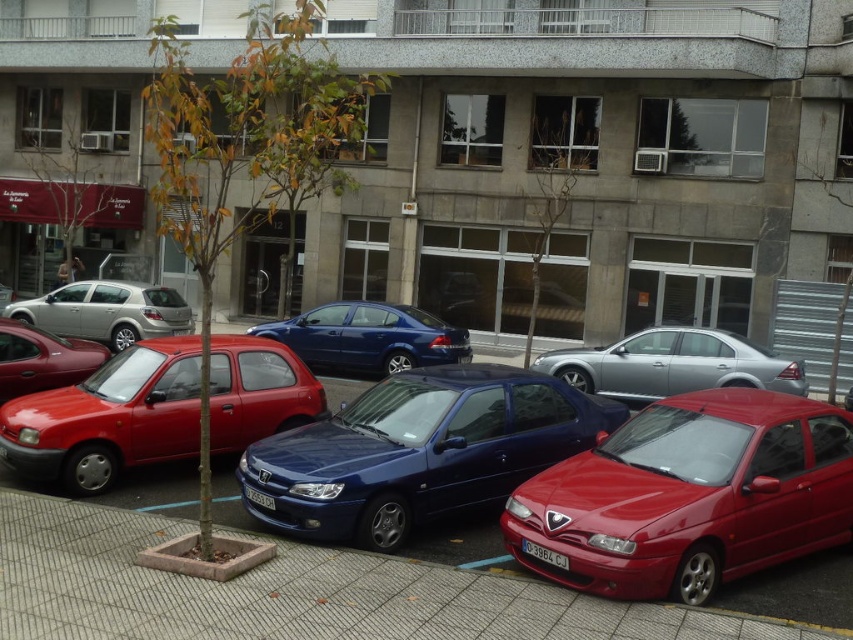
Between point (518, 424) and point (258, 360), which one is positioned behind?

Positioned behind is point (258, 360).

Looking at this image, can you confirm if glossy blue car at center is positioned above matte red car at center?

No, glossy blue car at center is not above matte red car at center.

Describe the element at coordinates (419, 451) in the screenshot. The width and height of the screenshot is (853, 640). I see `glossy blue car at center` at that location.

Find the location of `glossy blue car at center`. glossy blue car at center is located at coordinates (419, 451).

Does glossy blue sedan at center appear under silver metallic hatchback at center-left?

Indeed, glossy blue sedan at center is positioned under silver metallic hatchback at center-left.

Which is below, glossy blue sedan at center or silver metallic hatchback at center-left?

Positioned lower is glossy blue sedan at center.

You are a GUI agent. You are given a task and a screenshot of the screen. Output one action in this format:
    pyautogui.click(x=<x>, y=<y>)
    Task: Click on the glossy blue sedan at center
    This screenshot has width=853, height=640.
    Given the screenshot: What is the action you would take?
    pyautogui.click(x=368, y=337)

At what (x,y) coordinates should I click in order to perform the action: click on glossy blue sedan at center. Please return your answer as a coordinate pair (x, y). Looking at the image, I should click on (368, 337).

Can you confirm if shiny red hatchback at left is positioned to the left of black plastic license plate at lower center?

Indeed, shiny red hatchback at left is positioned on the left side of black plastic license plate at lower center.

Does shiny red hatchback at left have a greater width compared to black plastic license plate at lower center?

Yes.

Is point (0, 378) more distant than point (553, 557)?

Yes, point (0, 378) is behind point (553, 557).

Where is `shiny red hatchback at left`? shiny red hatchback at left is located at coordinates (42, 358).